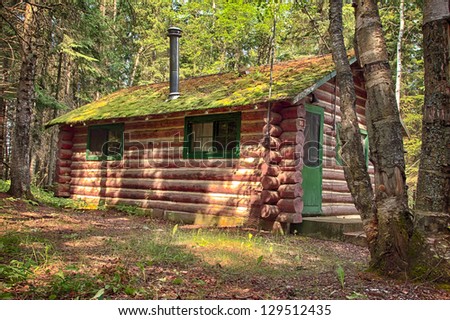
Locate an element on the screen. chimney is located at coordinates (173, 55).